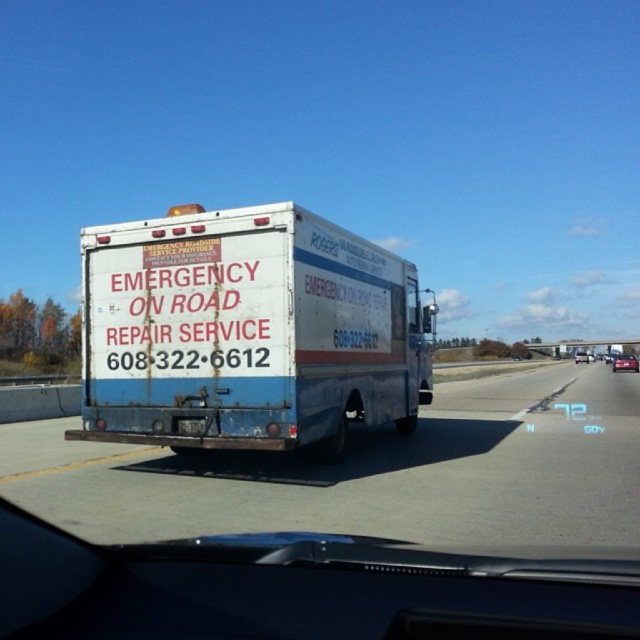
Question: Is white matte truck at center thinner than rusty metal truck at center?

Choices:
 (A) no
 (B) yes

Answer: (B)

Question: Is white matte truck at center further to camera compared to metallic silver sedan at center?

Choices:
 (A) yes
 (B) no

Answer: (B)

Question: Which of these objects is positioned closest to the rusty metal truck at center?

Choices:
 (A) white matte truck at center
 (B) metallic red sedan at center
 (C) black metal license plate at center
 (D) metallic silver sedan at center

Answer: (A)

Question: Which is nearer to the white matte truck at center?

Choices:
 (A) rusty metal truck at center
 (B) metallic red sedan at center
 (C) black metal license plate at center

Answer: (C)

Question: Which object appears farthest from the camera in this image?

Choices:
 (A) metallic red sedan at center
 (B) rusty metal truck at center
 (C) metallic silver sedan at center
 (D) white matte truck at center

Answer: (C)

Question: Can you confirm if black metal license plate at center is positioned to the left of metallic red sedan at center?

Choices:
 (A) yes
 (B) no

Answer: (A)